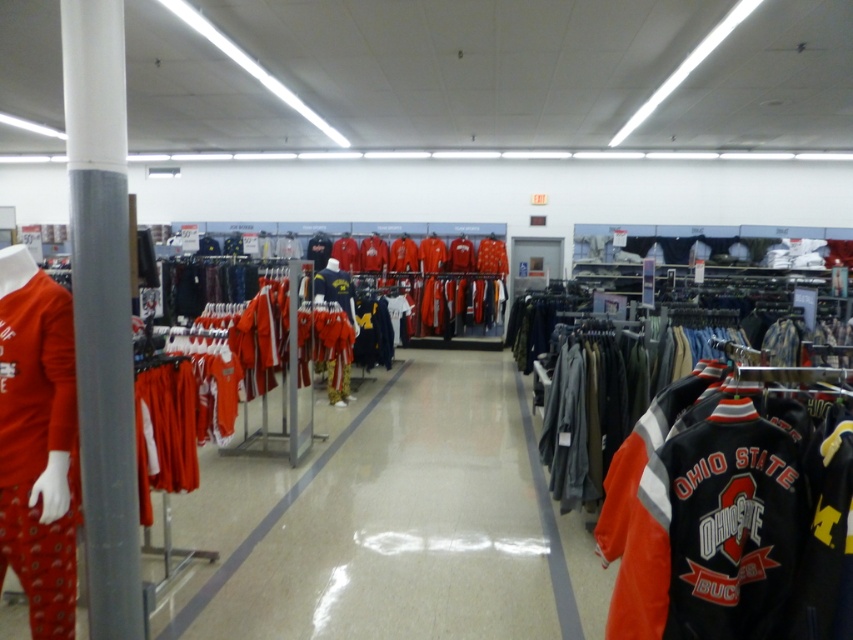
You are a customer in the store who wants to try on the orange leather jacket at right and the matte orange sweatshirt at left. You are currently standing at the center of the store. Which item is closer to you?

The matte orange sweatshirt at left is closer to you since it is on the left side of the orange leather jacket at right, and they are 5.79 feet apart.